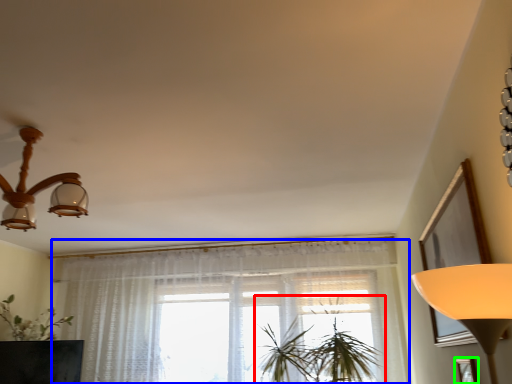
Question: Based on their relative distances, which object is farther from houseplant (highlighted by a red box)? Choose from curtain (highlighted by a blue box) and picture frame (highlighted by a green box).

Choices:
 (A) curtain
 (B) picture frame

Answer: (B)